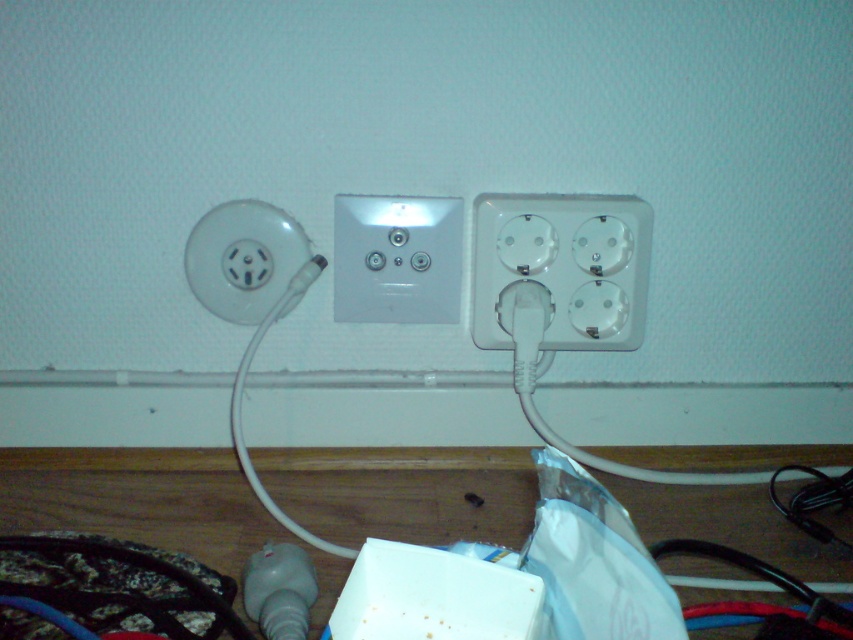
Can you confirm if white plastic socket at center is positioned to the left of white plastic socket at left?

No, white plastic socket at center is not to the left of white plastic socket at left.

Can you confirm if white plastic socket at center is positioned below white plastic socket at left?

No.

Between point (387, 241) and point (257, 243), which one is positioned in front?

Point (257, 243) is more forward.

Where is `white plastic socket at center`? white plastic socket at center is located at coordinates (396, 259).

Between white plastic socket at center right and white plastic socket at center, which one appears on the left side from the viewer's perspective?

From the viewer's perspective, white plastic socket at center appears more on the left side.

Which is in front, point (610, 320) or point (387, 236)?

Point (387, 236) is more forward.

Identify the location of white plastic socket at center right. (560, 273).

Who is positioned more to the right, white plastic socket at center right or white plastic socket at left?

From the viewer's perspective, white plastic socket at center right appears more on the right side.

I want to click on white plastic socket at center right, so click(x=560, y=273).